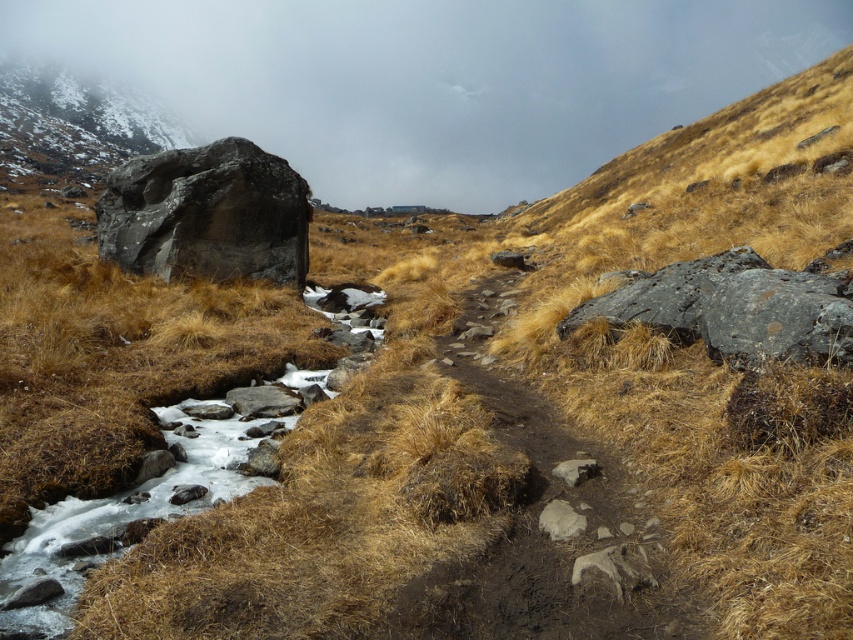
You are a hiker standing at the bottom of the mountain path. You see the foggy mist at upper center. Based on the scene description, where exactly is the foggy mist located in relation to the path and the large rock formation on the left?

The foggy mist at upper center is located at point (x=428, y=80), which is near the top center of the scene, above the path and the large rock formation on the left.

You are a hiker trying to navigate the path. You see the snowy granite boulder at upper left and the smooth gray rock at lower center. Which rock is closer to you as you stand on the path?

The smooth gray rock at lower center is behind the snowy granite boulder at upper left, so the snowy granite boulder at upper left is closer to you.